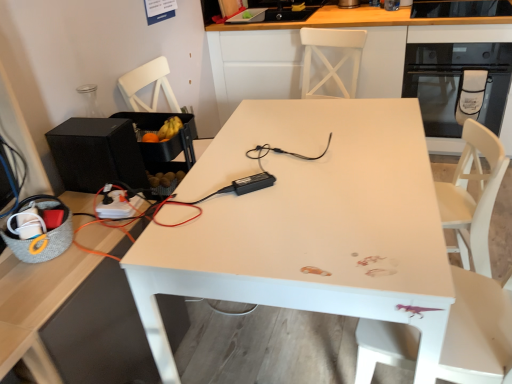
Question: Is white glossy cabinet at upper center next to white matte table at center?

Choices:
 (A) no
 (B) yes

Answer: (A)

Question: Does white glossy cabinet at upper center have a greater width compared to white matte table at center?

Choices:
 (A) yes
 (B) no

Answer: (B)

Question: Considering the relative positions of white glossy cabinet at upper center and white matte table at center in the image provided, is white glossy cabinet at upper center behind white matte table at center?

Choices:
 (A) no
 (B) yes

Answer: (B)

Question: Does white glossy cabinet at upper center have a lesser height compared to white matte table at center?

Choices:
 (A) yes
 (B) no

Answer: (B)

Question: Is white matte table at center surrounded by white glossy cabinet at upper center?

Choices:
 (A) no
 (B) yes

Answer: (A)

Question: Is white glossy cabinet at upper center far away from white matte table at center?

Choices:
 (A) no
 (B) yes

Answer: (B)

Question: Is black glass oven at upper right far away from black matte speaker at left?

Choices:
 (A) no
 (B) yes

Answer: (B)

Question: Is black glass oven at upper right taller than black matte speaker at left?

Choices:
 (A) no
 (B) yes

Answer: (B)

Question: Considering the relative sizes of black glass oven at upper right and black matte speaker at left in the image provided, is black glass oven at upper right wider than black matte speaker at left?

Choices:
 (A) yes
 (B) no

Answer: (A)

Question: Is the position of black glass oven at upper right less distant than that of black matte speaker at left?

Choices:
 (A) yes
 (B) no

Answer: (B)

Question: From the image's perspective, is black glass oven at upper right on top of black matte speaker at left?

Choices:
 (A) no
 (B) yes

Answer: (B)

Question: Is black glass oven at upper right looking in the opposite direction of black matte speaker at left?

Choices:
 (A) no
 (B) yes

Answer: (A)

Question: Considering the relative sizes of black matte speaker at left and white matte table at center in the image provided, is black matte speaker at left thinner than white matte table at center?

Choices:
 (A) no
 (B) yes

Answer: (B)